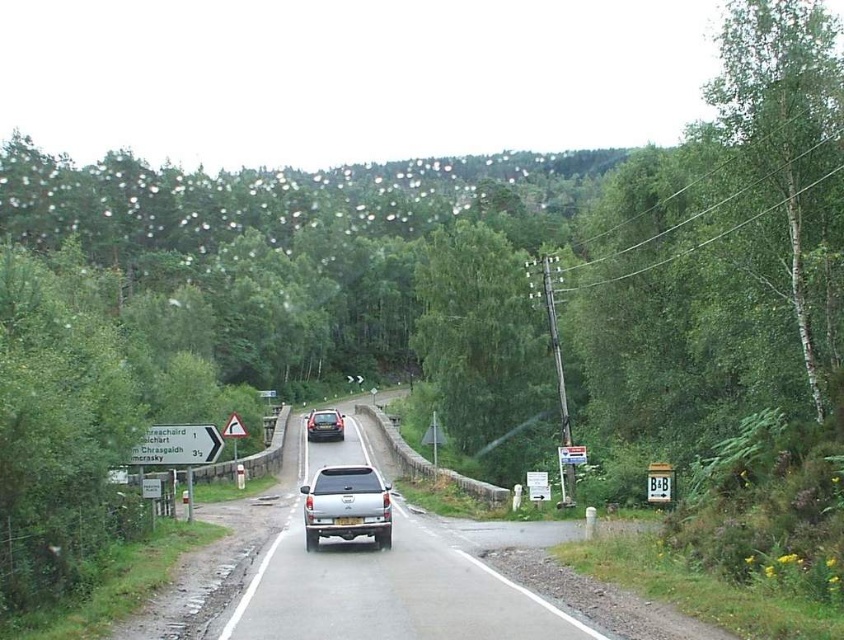
The width and height of the screenshot is (844, 640). In order to click on white bark tree at right in this screenshot , I will do `click(778, 112)`.

This screenshot has height=640, width=844. Describe the element at coordinates (778, 112) in the screenshot. I see `white bark tree at right` at that location.

What are the coordinates of `white bark tree at right` in the screenshot? It's located at (778, 112).

Who is lower down, silver metallic suv at center or black plastic triangle at upper center?

Positioned lower is silver metallic suv at center.

Based on the photo, is silver metallic suv at center below black plastic triangle at upper center?

Yes, silver metallic suv at center is below black plastic triangle at upper center.

Who is more forward, (353, 600) or (237, 433)?

Positioned in front is point (353, 600).

The width and height of the screenshot is (844, 640). I want to click on silver metallic suv at center, so click(390, 579).

Looking at this image, between white plastic sign at left and satin silver suv at center, which one appears on the right side from the viewer's perspective?

Positioned to the right is white plastic sign at left.

This screenshot has width=844, height=640. Describe the element at coordinates (177, 445) in the screenshot. I see `white plastic sign at left` at that location.

Measure the distance between white plastic sign at left and camera.

white plastic sign at left and camera are 18.23 meters apart from each other.

Find the location of `white plastic sign at left`. white plastic sign at left is located at coordinates (177, 445).